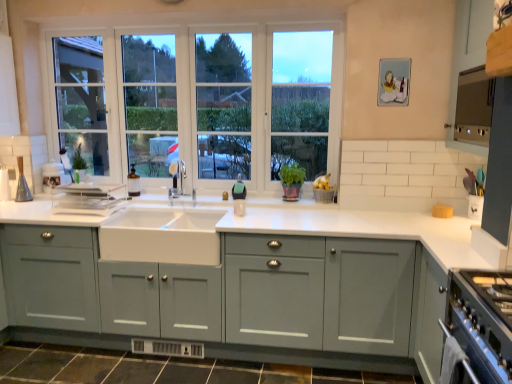
Question: Considering the relative positions of satin stainless steel range hood at upper right and white ceramic sink at center in the image provided, is satin stainless steel range hood at upper right behind white ceramic sink at center?

Choices:
 (A) yes
 (B) no

Answer: (B)

Question: Is satin stainless steel range hood at upper right not near white ceramic sink at center?

Choices:
 (A) yes
 (B) no

Answer: (A)

Question: Is the position of satin stainless steel range hood at upper right less distant than that of white ceramic sink at center?

Choices:
 (A) no
 (B) yes

Answer: (B)

Question: Considering the relative sizes of satin stainless steel range hood at upper right and white ceramic sink at center in the image provided, is satin stainless steel range hood at upper right taller than white ceramic sink at center?

Choices:
 (A) yes
 (B) no

Answer: (A)

Question: From the image's perspective, is satin stainless steel range hood at upper right under white ceramic sink at center?

Choices:
 (A) no
 (B) yes

Answer: (A)

Question: Considering the positions of satin nickel faucet at center and brown tile at lower center in the image, is satin nickel faucet at center wider or thinner than brown tile at lower center?

Choices:
 (A) wide
 (B) thin

Answer: (B)

Question: Considering their positions, is satin nickel faucet at center located in front of or behind brown tile at lower center?

Choices:
 (A) behind
 (B) front

Answer: (A)

Question: From the image's perspective, is satin nickel faucet at center positioned above or below brown tile at lower center?

Choices:
 (A) below
 (B) above

Answer: (B)

Question: Is satin nickel faucet at center bigger or smaller than brown tile at lower center?

Choices:
 (A) big
 (B) small

Answer: (B)

Question: From the image's perspective, is satin nickel faucet at center located above or below matte gray cabinet at upper right, acting as the second cabinetry starting from the bottom?

Choices:
 (A) above
 (B) below

Answer: (B)

Question: Looking at their shapes, would you say satin nickel faucet at center is wider or thinner than matte gray cabinet at upper right, the second cabinetry when ordered from left to right?

Choices:
 (A) thin
 (B) wide

Answer: (A)

Question: Visually, is satin nickel faucet at center positioned to the left or to the right of matte gray cabinet at upper right, the second cabinetry when ordered from left to right?

Choices:
 (A) right
 (B) left

Answer: (B)

Question: Is satin nickel faucet at center spatially inside matte gray cabinet at upper right, acting as the second cabinetry starting from the bottom, or outside of it?

Choices:
 (A) inside
 (B) outside

Answer: (B)

Question: Considering the positions of white ceramic sink at center and clear glass window at center in the image, is white ceramic sink at center bigger or smaller than clear glass window at center?

Choices:
 (A) big
 (B) small

Answer: (B)

Question: In terms of height, does white ceramic sink at center look taller or shorter compared to clear glass window at center?

Choices:
 (A) short
 (B) tall

Answer: (A)